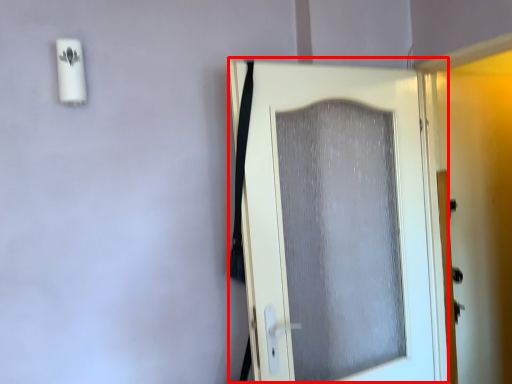
Question: From the image's perspective, where is door (annotated by the red box) located in relation to screen door in the image?

Choices:
 (A) below
 (B) above

Answer: (A)